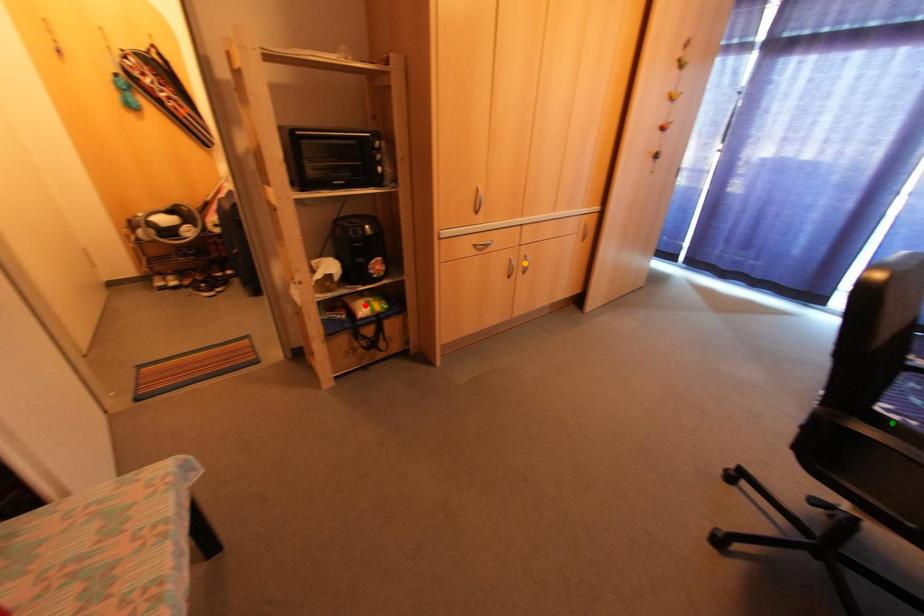
Consider the image. Order these from nearest to farthest:
green point, orange point, red point

green point < red point < orange point